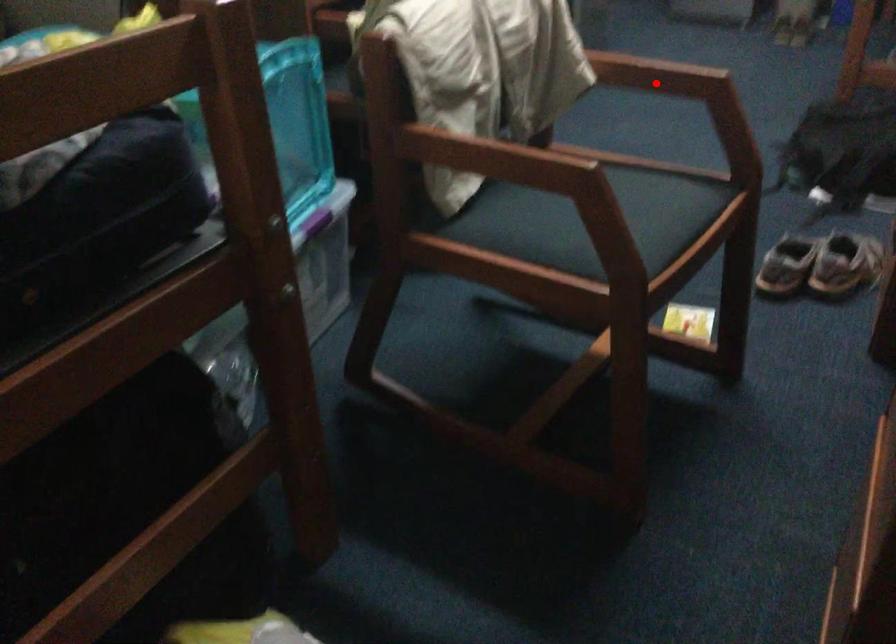
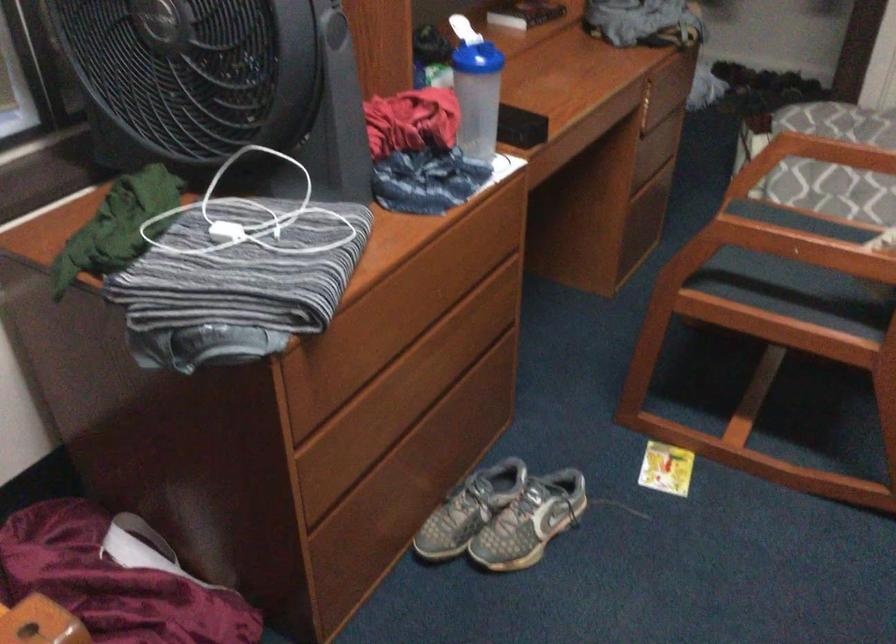
Find the pixel in the second image that matches the highlighted location in the first image.

(790, 245)